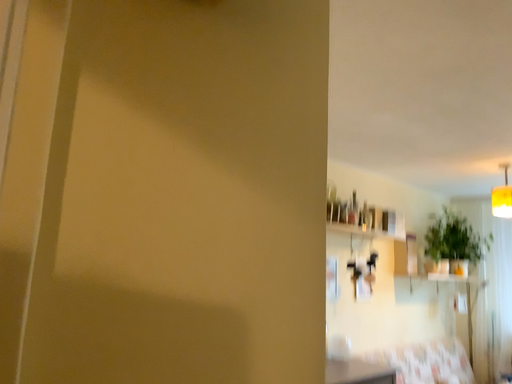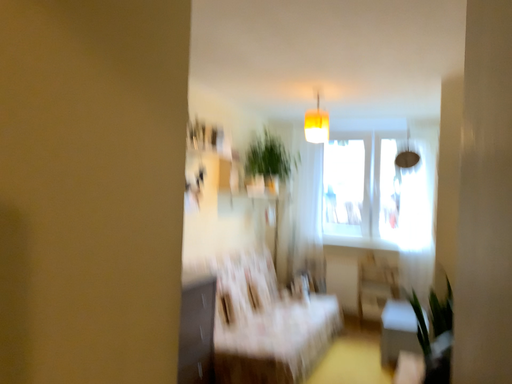
Question: How did the camera likely rotate when shooting the video?

Choices:
 (A) rotated downward
 (B) rotated upward

Answer: (A)